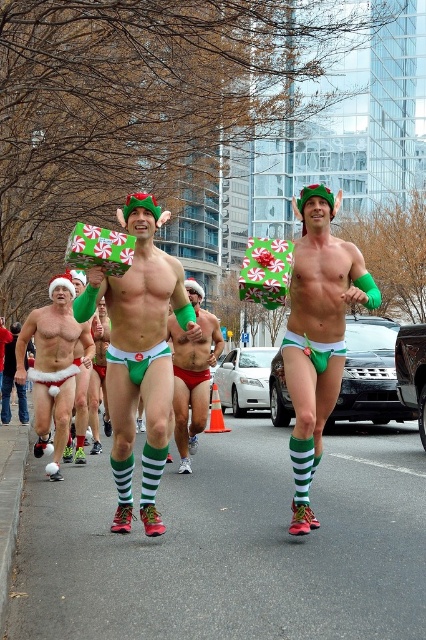
You are organizing a Christmas charity run and need to ensure participants can safely pass through the area. The participants are wearing matte green underwear at center. What is the minimum distance you should maintain between two participants to ensure they don

The minimum distance you should maintain between two participants wearing matte green underwear at center is 18.51 feet to ensure they can safely pass through the area.

You are a photographer at the event and want to take a picture of the matte green underwear at center. Where should you aim your camera?

You should aim your camera at point [317,333] to capture the matte green underwear at center.